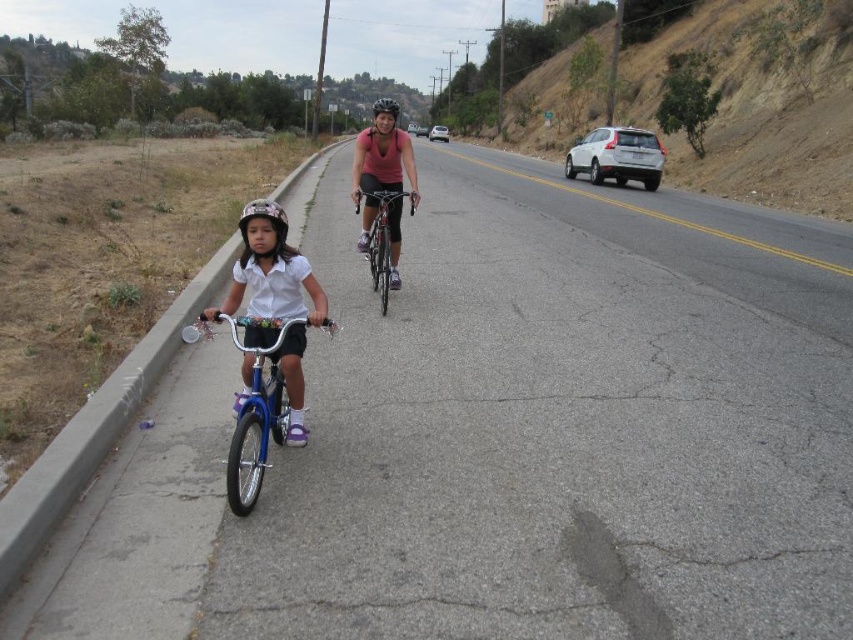
Is metallic blue bicycle at left to the left of matte black helmet at center from the viewer's perspective?

In fact, metallic blue bicycle at left is to the right of matte black helmet at center.

Who is more distant from viewer, (273, 260) or (396, 106)?

The point (396, 106) is behind.

Is point (270, 308) in front of point (380, 108)?

Yes, point (270, 308) is in front of point (380, 108).

Find the location of a particular element. metallic blue bicycle at left is located at coordinates (270, 269).

Can you confirm if blue metallic bicycle at left is taller than silver metallic sedan at center?

Incorrect, blue metallic bicycle at left's height is not larger of silver metallic sedan at center's.

Can you confirm if blue metallic bicycle at left is positioned to the right of silver metallic sedan at center?

Incorrect, blue metallic bicycle at left is not on the right side of silver metallic sedan at center.

I want to click on blue metallic bicycle at left, so click(258, 406).

Where is `blue metallic bicycle at left`? blue metallic bicycle at left is located at coordinates (258, 406).

Does metallic blue bicycle at left appear under blue metallic bicycle at left?

Actually, metallic blue bicycle at left is above blue metallic bicycle at left.

Who is positioned more to the left, metallic blue bicycle at left or blue metallic bicycle at left?

blue metallic bicycle at left is more to the left.

Does point (289, 285) come behind point (302, 326)?

Yes, it is behind point (302, 326).

This screenshot has width=853, height=640. I want to click on metallic blue bicycle at left, so click(x=270, y=269).